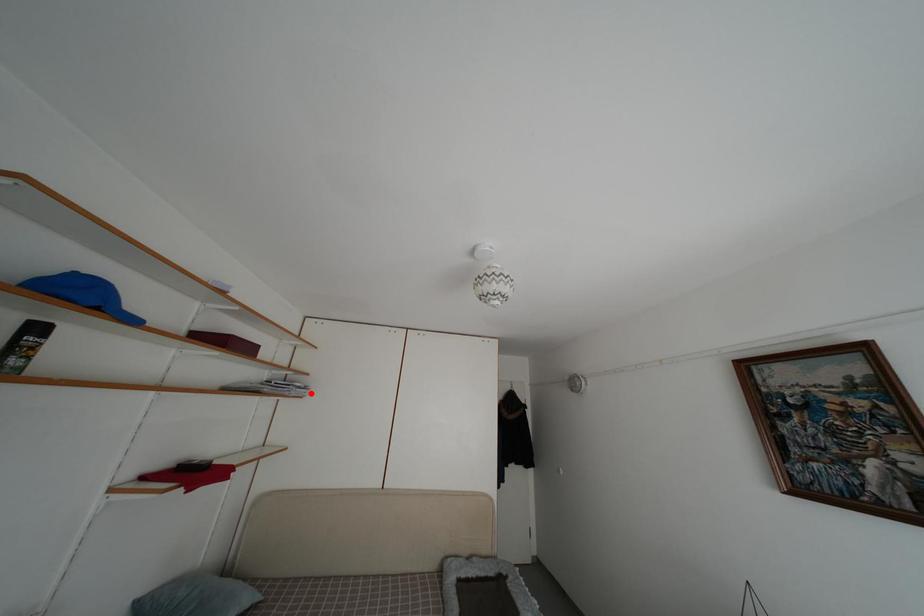
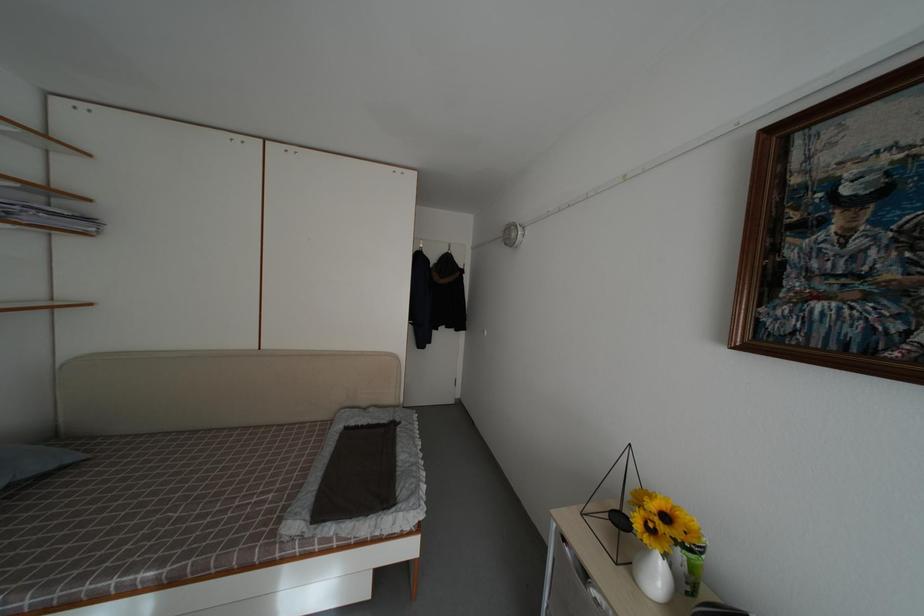
Where in the second image is the point corresponding to the highlighted location from the first image?

(94, 225)